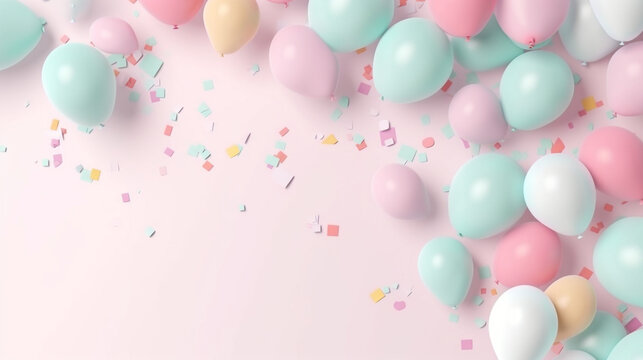
The width and height of the screenshot is (643, 360). What are the coordinates of `dark pink light pink and pink balloons` in the screenshot? It's located at (179, 15), (114, 43), (309, 60), (403, 185), (478, 110), (465, 17), (529, 28), (523, 252), (620, 158), (631, 83).